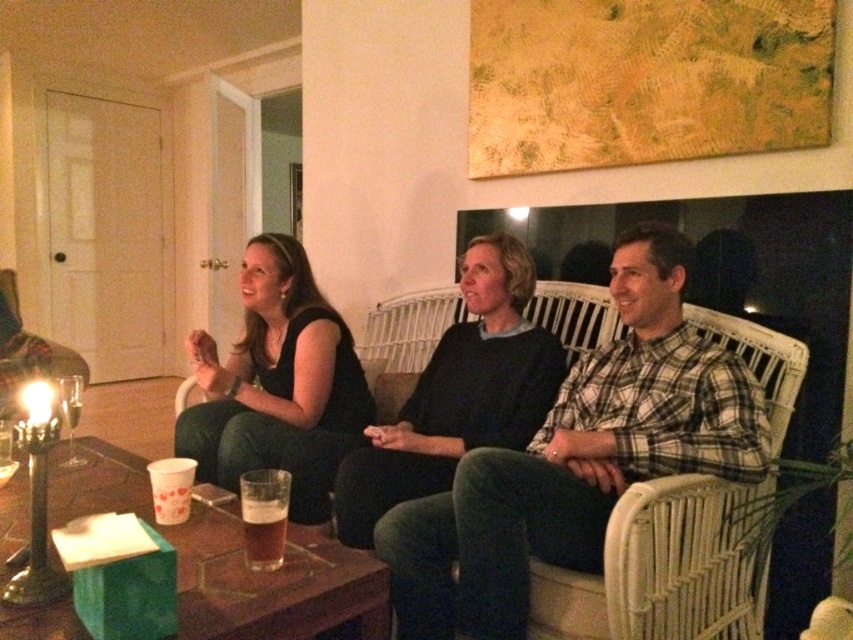
Measure the distance between point (577, 380) and camera.

Point (577, 380) is 6.48 feet away from camera.

I want to click on plaid cotton shirt at center, so click(578, 458).

Is point (670, 301) positioned in front of point (245, 532)?

That is False.

Find the location of `plaid cotton shirt at center`. plaid cotton shirt at center is located at coordinates (578, 458).

Who is more distant from viewer, (399,522) or (184,618)?

The point (399,522) is behind.

Can you confirm if plaid cotton shirt at center is smaller than wooden table at center?

Actually, plaid cotton shirt at center might be larger than wooden table at center.

The width and height of the screenshot is (853, 640). In order to click on plaid cotton shirt at center in this screenshot , I will do pyautogui.click(x=578, y=458).

The width and height of the screenshot is (853, 640). I want to click on plaid cotton shirt at center, so click(x=578, y=458).

Can you confirm if plaid cotton shirt at center is positioned to the right of dark gray sweater at center?

Yes, plaid cotton shirt at center is to the right of dark gray sweater at center.

Who is taller, plaid cotton shirt at center or dark gray sweater at center?

With more height is plaid cotton shirt at center.

Between point (531, 509) and point (367, 522), which one is positioned behind?

The point (367, 522) is behind.

This screenshot has height=640, width=853. I want to click on plaid cotton shirt at center, so click(x=578, y=458).